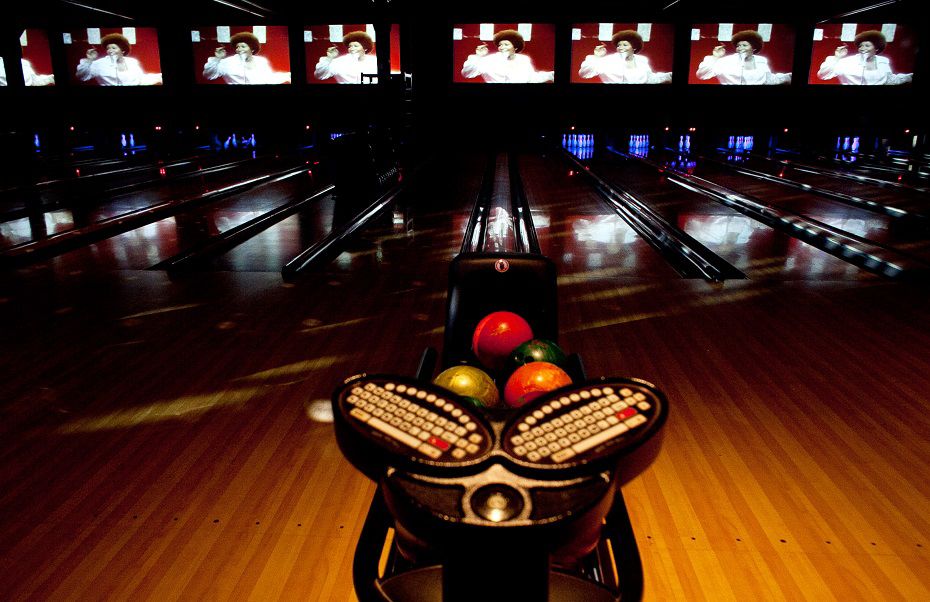
At what (x,y) coordinates should I click in order to perform the action: click on video screens. Please return your answer as a coordinate pair (x, y). This screenshot has height=602, width=930. Looking at the image, I should click on (33, 61), (133, 60), (242, 60), (344, 51), (499, 55), (630, 51), (751, 56), (843, 50).